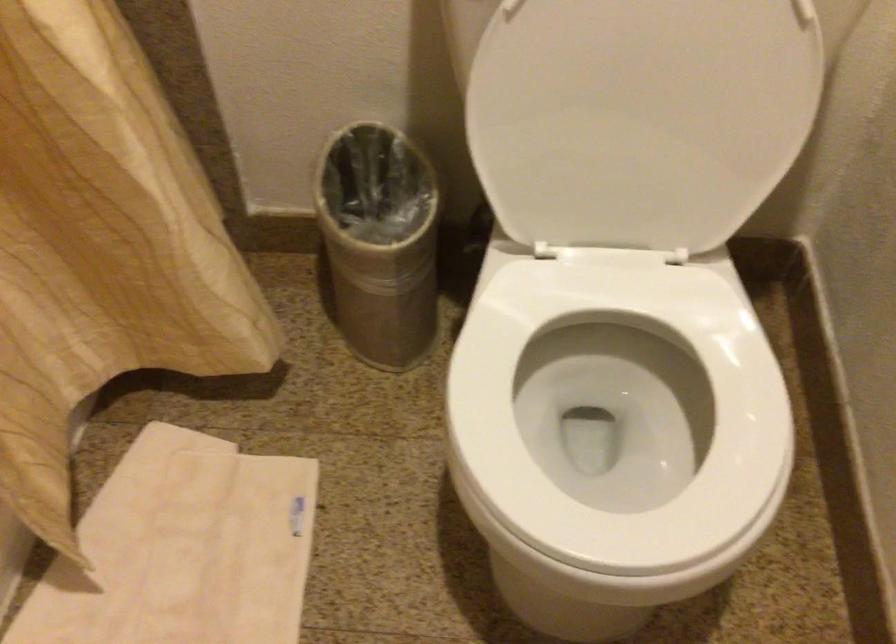
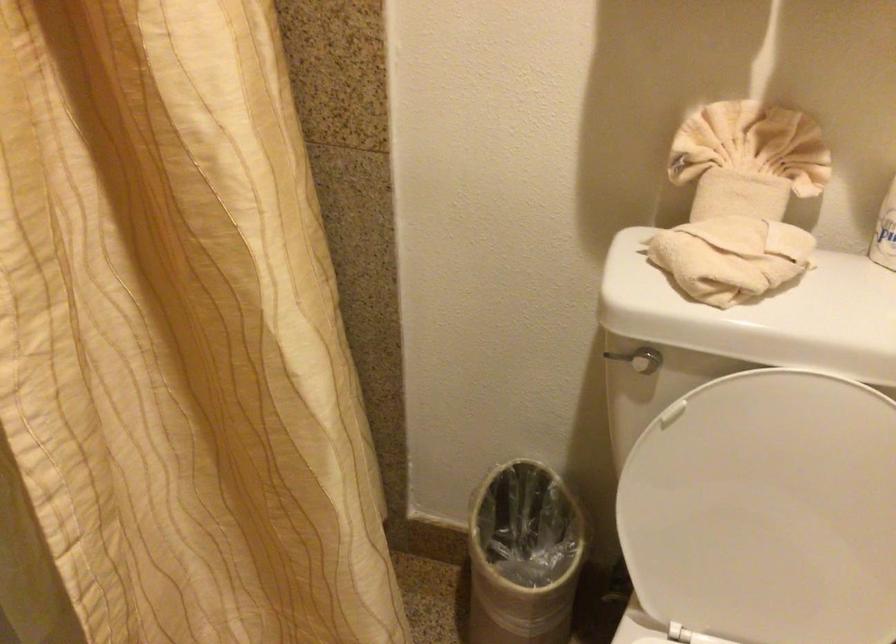
Question: How did the camera likely rotate?

Choices:
 (A) Left
 (B) Right
 (C) Up
 (D) Down

Answer: (C)